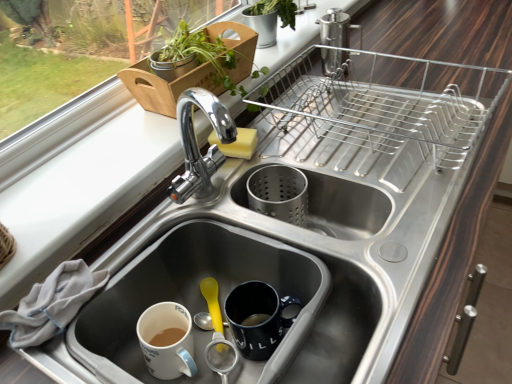
Where is `green leafy plant at upper left, which is counted as the first houseplant, starting from the front`? This screenshot has width=512, height=384. green leafy plant at upper left, which is counted as the first houseplant, starting from the front is located at coordinates (236, 46).

What do you see at coordinates (236, 46) in the screenshot? I see `green leafy plant at upper left, which is counted as the first houseplant, starting from the front` at bounding box center [236, 46].

The width and height of the screenshot is (512, 384). Describe the element at coordinates (300, 248) in the screenshot. I see `stainless steel sink at center, acting as the second sink starting from the left` at that location.

Measure the distance between point (298,238) and camera.

Point (298,238) and camera are 28.07 inches apart.

Find the location of a particular element. yellow sponge at center is located at coordinates (237, 143).

You are a GUI agent. You are given a task and a screenshot of the screen. Output one action in this format:
    pyautogui.click(x=<x>, y=<y>)
    Task: Click on the green leafy plant at upper left, which ranks as the 2th houseplant in back-to-front order
    The height and width of the screenshot is (384, 512).
    Given the screenshot: What is the action you would take?
    [236, 46]

Considering their positions, is white matte sink at lower left, the 1th sink viewed from the left, located in front of or behind white cloth at lower left?

In the image, white matte sink at lower left, the 1th sink viewed from the left, appears in front of white cloth at lower left.

Is white matte sink at lower left, marked as the second sink in a right-to-left arrangement, shorter than white cloth at lower left?

Incorrect, the height of white matte sink at lower left, marked as the second sink in a right-to-left arrangement, does not fall short of that of white cloth at lower left.

Are white matte sink at lower left, the 1th sink viewed from the left, and white cloth at lower left making contact?

They are not placed beside each other.

Can you confirm if white matte sink at lower left, marked as the second sink in a right-to-left arrangement, is wider than white cloth at lower left?

Yes.

From a real-world perspective, between green matte plant at upper center, which is the second houseplant in front-to-back order, and white cloth at lower left, who is vertically lower?

white cloth at lower left.

Between green matte plant at upper center, which is the second houseplant in front-to-back order, and white cloth at lower left, which one has larger width?

green matte plant at upper center, which is the second houseplant in front-to-back order.

In terms of size, does green matte plant at upper center, which is the second houseplant in front-to-back order, appear bigger or smaller than white cloth at lower left?

Clearly, green matte plant at upper center, which is the second houseplant in front-to-back order, is larger in size than white cloth at lower left.

Considering the sizes of objects green matte plant at upper center, which is the second houseplant in front-to-back order, and white cloth at lower left in the image provided, who is shorter, green matte plant at upper center, which is the second houseplant in front-to-back order, or white cloth at lower left?

With less height is white cloth at lower left.

From the image's perspective, is stainless steel sink at center, acting as the second sink starting from the left, beneath green leafy plant at upper left, which is counted as the first houseplant, starting from the front?

Yes, from the image's perspective, stainless steel sink at center, acting as the second sink starting from the left, is below green leafy plant at upper left, which is counted as the first houseplant, starting from the front.

Is stainless steel sink at center, acting as the second sink starting from the left, placed right next to green leafy plant at upper left, which is counted as the first houseplant, starting from the front?

No, stainless steel sink at center, acting as the second sink starting from the left, is not making contact with green leafy plant at upper left, which is counted as the first houseplant, starting from the front.

Considering the sizes of objects stainless steel sink at center, acting as the second sink starting from the left, and green leafy plant at upper left, which ranks as the 2th houseplant in back-to-front order, in the image provided, who is shorter, stainless steel sink at center, acting as the second sink starting from the left, or green leafy plant at upper left, which ranks as the 2th houseplant in back-to-front order,?

stainless steel sink at center, acting as the second sink starting from the left, is shorter.

How distant is stainless steel sink at center, the 1th sink when ordered from right to left, from green leafy plant at upper left, which ranks as the 2th houseplant in back-to-front order?

stainless steel sink at center, the 1th sink when ordered from right to left, is 11.14 inches from green leafy plant at upper left, which ranks as the 2th houseplant in back-to-front order.

Is white cloth at lower left at the left side of green matte plant at upper center, the 1th houseplant when ordered from back to front?

Indeed, white cloth at lower left is positioned on the left side of green matte plant at upper center, the 1th houseplant when ordered from back to front.

Relative to green matte plant at upper center, which is the second houseplant in front-to-back order, is white cloth at lower left in front or behind?

white cloth at lower left is positioned closer to the viewer than green matte plant at upper center, which is the second houseplant in front-to-back order.

Is white cloth at lower left oriented towards green matte plant at upper center, which is the second houseplant in front-to-back order?

No, white cloth at lower left is not turned towards green matte plant at upper center, which is the second houseplant in front-to-back order.

Is white cloth at lower left not inside green matte plant at upper center, the 1th houseplant when ordered from back to front?

Yes, white cloth at lower left is not within green matte plant at upper center, the 1th houseplant when ordered from back to front.

Considering their positions, is stainless steel sink at center, acting as the second sink starting from the left, located in front of or behind yellow sponge at center?

stainless steel sink at center, acting as the second sink starting from the left, is positioned closer to the viewer than yellow sponge at center.

Which of these two, stainless steel sink at center, the 1th sink when ordered from right to left, or yellow sponge at center, is bigger?

stainless steel sink at center, the 1th sink when ordered from right to left, is bigger.

Considering the positions of objects stainless steel sink at center, acting as the second sink starting from the left, and yellow sponge at center in the image provided, who is more to the left, stainless steel sink at center, acting as the second sink starting from the left, or yellow sponge at center?

From the viewer's perspective, yellow sponge at center appears more on the left side.

Who is taller, stainless steel sink at center, the 1th sink when ordered from right to left, or yellow sponge at center?

With more height is yellow sponge at center.

Is white cloth at lower left oriented towards green leafy plant at upper left, which ranks as the 2th houseplant in back-to-front order?

No.

From the image's perspective, which one is positioned higher, white cloth at lower left or green leafy plant at upper left, which ranks as the 2th houseplant in back-to-front order?

green leafy plant at upper left, which ranks as the 2th houseplant in back-to-front order.

Does white cloth at lower left have a greater height compared to green leafy plant at upper left, which is counted as the first houseplant, starting from the front?

Incorrect, the height of white cloth at lower left is not larger of that of green leafy plant at upper left, which is counted as the first houseplant, starting from the front.

From the white cloth at lower left, count 1st houseplants backward and point to it. Please provide its 2D coordinates.

[(236, 46)]

Considering the points (315, 332) and (266, 31), which point is behind, point (315, 332) or point (266, 31)?

The point (266, 31) is behind.

From a real-world perspective, who is located lower, stainless steel sink at center, the 1th sink when ordered from right to left, or green matte plant at upper center, which is the second houseplant in front-to-back order?

stainless steel sink at center, the 1th sink when ordered from right to left, is physically lower.

Consider the image. Could you measure the distance between stainless steel sink at center, the 1th sink when ordered from right to left, and green matte plant at upper center, the 1th houseplant when ordered from back to front?

22.69 inches.

Which object is wider, stainless steel sink at center, acting as the second sink starting from the left, or green matte plant at upper center, the 1th houseplant when ordered from back to front?

stainless steel sink at center, acting as the second sink starting from the left.

Where is `material that appears behind the white matte sink at lower left, marked as the second sink in a right-to-left arrangement`? material that appears behind the white matte sink at lower left, marked as the second sink in a right-to-left arrangement is located at coordinates (52, 304).

What are the coordinates of `material located below the green matte plant at upper center, which is the second houseplant in front-to-back order (from the image's perspective)` in the screenshot? It's located at (52, 304).

When comparing their distances from white matte sink at lower left, the 1th sink viewed from the left, does green leafy plant at upper left, which ranks as the 2th houseplant in back-to-front order, or yellow sponge at center seem further?

green leafy plant at upper left, which ranks as the 2th houseplant in back-to-front order, is positioned further to the anchor white matte sink at lower left, the 1th sink viewed from the left.

Considering their positions, is green matte plant at upper center, which is the second houseplant in front-to-back order, positioned further to yellow sponge at center than stainless steel sink at center, acting as the second sink starting from the left?

green matte plant at upper center, which is the second houseplant in front-to-back order, is further to yellow sponge at center.

Based on their spatial positions, is green matte plant at upper center, which is the second houseplant in front-to-back order, or white cloth at lower left further from stainless steel sink at center, the 1th sink when ordered from right to left?

green matte plant at upper center, which is the second houseplant in front-to-back order, is positioned further to the anchor stainless steel sink at center, the 1th sink when ordered from right to left.

From the image, which object appears to be nearer to stainless steel sink at center, the 1th sink when ordered from right to left, white matte sink at lower left, marked as the second sink in a right-to-left arrangement, or yellow sponge at center?

white matte sink at lower left, marked as the second sink in a right-to-left arrangement, is closer to stainless steel sink at center, the 1th sink when ordered from right to left.

Considering their positions, is yellow sponge at center positioned closer to white cloth at lower left than green leafy plant at upper left, which is counted as the first houseplant, starting from the front?

The object closer to white cloth at lower left is yellow sponge at center.

Based on their spatial positions, is green leafy plant at upper left, which is counted as the first houseplant, starting from the front, or yellow sponge at center further from green matte plant at upper center, which is the second houseplant in front-to-back order?

yellow sponge at center lies further to green matte plant at upper center, which is the second houseplant in front-to-back order, than the other object.

Estimate the real-world distances between objects in this image. Which object is closer to yellow sponge at center, white matte sink at lower left, marked as the second sink in a right-to-left arrangement, or stainless steel sink at center, the 1th sink when ordered from right to left?

stainless steel sink at center, the 1th sink when ordered from right to left.

Looking at the image, which one is located closer to stainless steel sink at center, the 1th sink when ordered from right to left, green leafy plant at upper left, which ranks as the 2th houseplant in back-to-front order, or white matte sink at lower left, marked as the second sink in a right-to-left arrangement?

white matte sink at lower left, marked as the second sink in a right-to-left arrangement, is positioned closer to the anchor stainless steel sink at center, the 1th sink when ordered from right to left.

You are a GUI agent. You are given a task and a screenshot of the screen. Output one action in this format:
    pyautogui.click(x=<x>, y=<y>)
    Task: Click on the houseplant between stainless steel sink at center, the 1th sink when ordered from right to left, and green matte plant at upper center, the 1th houseplant when ordered from back to front, in the front-back direction
    
    Given the screenshot: What is the action you would take?
    pyautogui.click(x=236, y=46)

Image resolution: width=512 pixels, height=384 pixels. Identify the location of material between green leafy plant at upper left, which ranks as the 2th houseplant in back-to-front order, and white matte sink at lower left, the 1th sink viewed from the left, in the vertical direction. (52, 304).

You are a GUI agent. You are given a task and a screenshot of the screen. Output one action in this format:
    pyautogui.click(x=<x>, y=<y>)
    Task: Click on the sink between stainless steel sink at center, the 1th sink when ordered from right to left, and green matte plant at upper center, the 1th houseplant when ordered from back to front, from front to back
    Image resolution: width=512 pixels, height=384 pixels.
    Given the screenshot: What is the action you would take?
    pyautogui.click(x=195, y=300)

This screenshot has height=384, width=512. I want to click on material between white matte sink at lower left, marked as the second sink in a right-to-left arrangement, and yellow sponge at center from front to back, so click(52, 304).